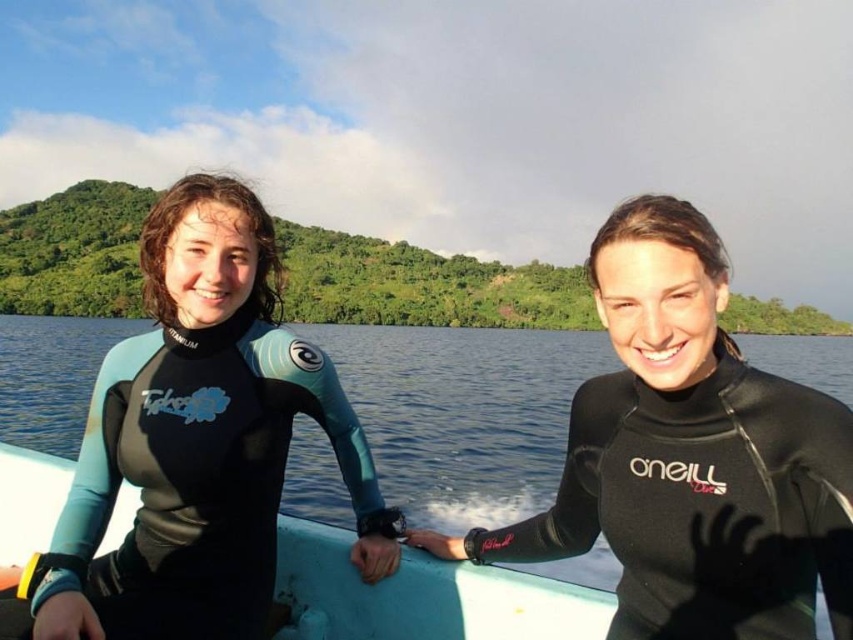
Question: Is teal matte wetsuit at left in front of white matte surfboard at center?

Choices:
 (A) no
 (B) yes

Answer: (B)

Question: Estimate the real-world distances between objects in this image. Which object is farther from the teal matte wetsuit at left?

Choices:
 (A) blue water at center
 (B) black matte wetsuit at center

Answer: (A)

Question: Which object is the farthest from the white matte surfboard at center?

Choices:
 (A) black matte wetsuit at center
 (B) blue water at center
 (C) teal matte wetsuit at left

Answer: (B)

Question: Can you confirm if teal matte wetsuit at left is positioned above blue water at center?

Choices:
 (A) yes
 (B) no

Answer: (A)

Question: In this image, where is teal matte wetsuit at left located relative to black matte wetsuit at center?

Choices:
 (A) above
 (B) below

Answer: (A)

Question: Which is farther from the teal matte wetsuit at left?

Choices:
 (A) white matte surfboard at center
 (B) blue water at center

Answer: (B)